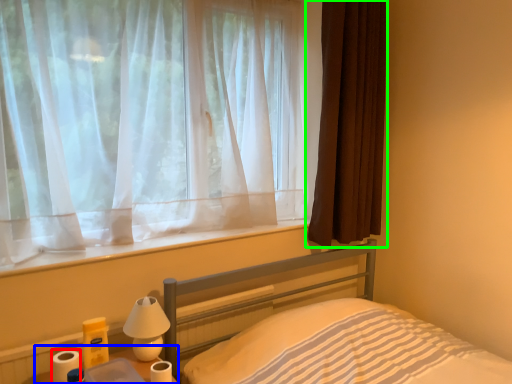
Question: Estimate the real-world distances between objects in this image. Which object is closer to toilet paper (highlighted by a red box), table (highlighted by a blue box) or curtain (highlighted by a green box)?

Choices:
 (A) table
 (B) curtain

Answer: (A)